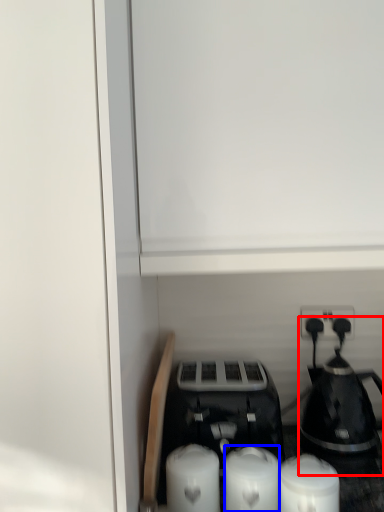
Question: Which of the following is the closest to the observer, coffee maker (highlighted by a red box) or candle (highlighted by a blue box)?

Choices:
 (A) coffee maker
 (B) candle

Answer: (B)